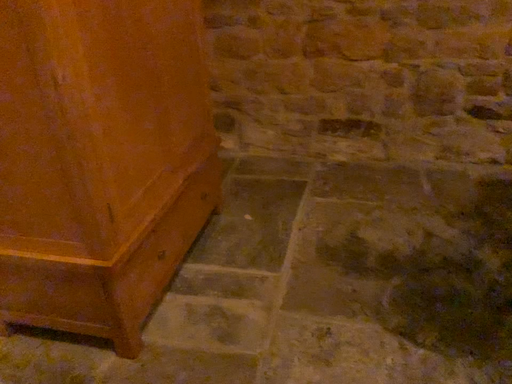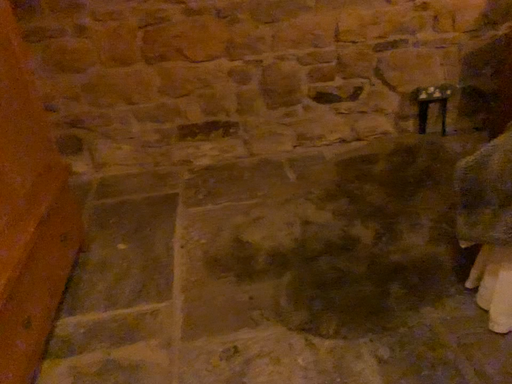
Question: How did the camera likely rotate when shooting the video?

Choices:
 (A) rotated left
 (B) rotated right

Answer: (B)